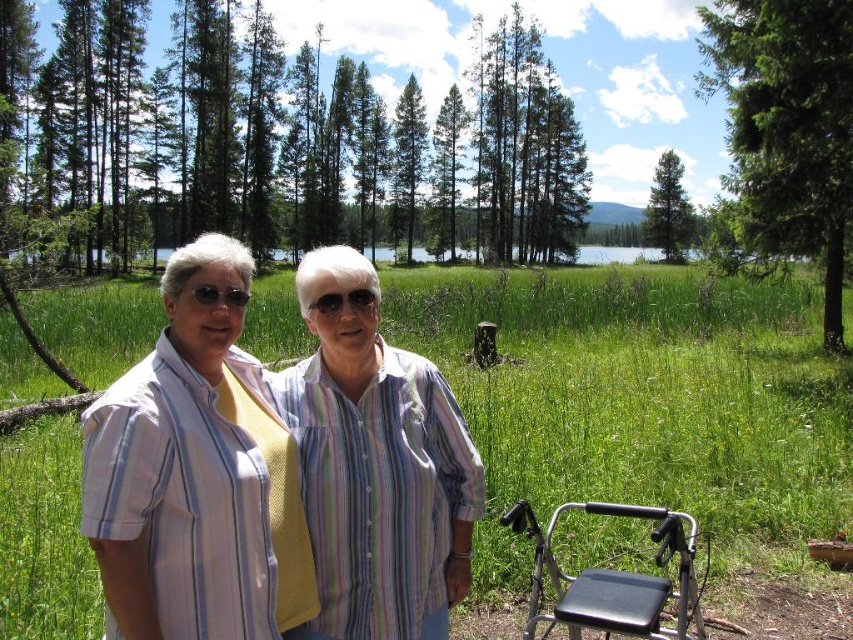
Is green leafy tree at upper right bigger than green matte tree at upper center?

No.

Can you confirm if green leafy tree at upper right is positioned to the right of green matte tree at upper center?

In fact, green leafy tree at upper right is to the left of green matte tree at upper center.

Is point (788, 177) positioned behind point (689, 204)?

No, (788, 177) is closer to viewer.

The height and width of the screenshot is (640, 853). Identify the location of green leafy tree at upper right. (787, 128).

Who is taller, green leafy trees at upper center or striped cotton shirt at center?

green leafy trees at upper center

Is green leafy trees at upper center wider than striped cotton shirt at center?

Indeed, green leafy trees at upper center has a greater width compared to striped cotton shirt at center.

Does point (164, 166) lie in front of point (106, 458)?

No, (164, 166) is behind (106, 458).

Locate an element on the screen. green leafy trees at upper center is located at coordinates (302, 141).

Can you confirm if striped cotton shirt at center is wider than black plastic folding chair at lower right?

Indeed, striped cotton shirt at center has a greater width compared to black plastic folding chair at lower right.

Does striped cotton shirt at center appear under black plastic folding chair at lower right?

No, striped cotton shirt at center is not below black plastic folding chair at lower right.

Image resolution: width=853 pixels, height=640 pixels. What do you see at coordinates (196, 474) in the screenshot?
I see `striped cotton shirt at center` at bounding box center [196, 474].

Locate an element on the screen. The height and width of the screenshot is (640, 853). striped cotton shirt at center is located at coordinates (196, 474).